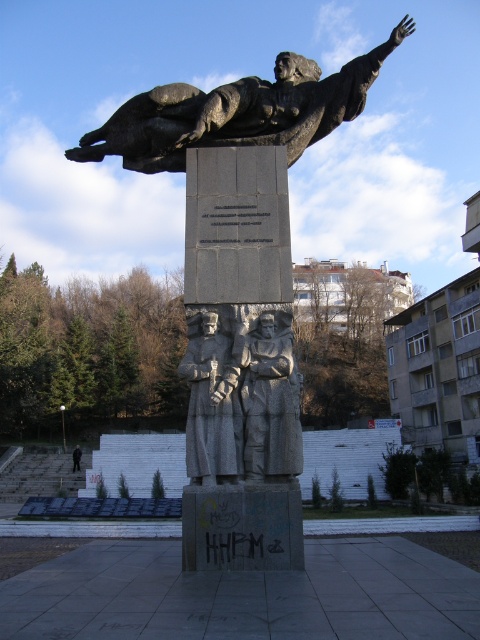
Question: Which point is closer to the camera?

Choices:
 (A) bronze statue at center
 (B) gray stone statue at center
 (C) dark gray stone statue at center

Answer: (A)

Question: Which object is closer to the camera taking this photo?

Choices:
 (A) bronze statue at upper center
 (B) granite statue at center
 (C) bronze statue at center
 (D) gray stone statue at center

Answer: (C)

Question: From the image, what is the correct spatial relationship of bronze statue at upper center in relation to gray stone statue at center?

Choices:
 (A) above
 (B) below

Answer: (A)

Question: Can you confirm if bronze statue at center is thinner than bronze statue at upper center?

Choices:
 (A) no
 (B) yes

Answer: (B)

Question: Does bronze statue at center have a lesser width compared to gray stone statue at center?

Choices:
 (A) no
 (B) yes

Answer: (A)

Question: Estimate the real-world distances between objects in this image. Which object is farther from the dark gray stone statue at center?

Choices:
 (A) bronze statue at upper center
 (B) granite statue at center

Answer: (A)